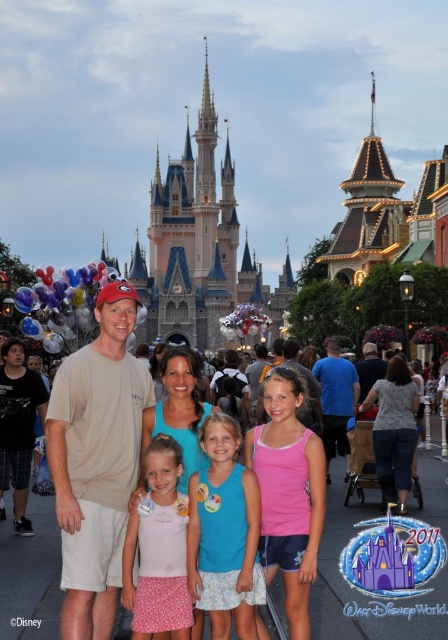
Does blue cotton tank top at center lie in front of pink fabric dress at center?

No, blue cotton tank top at center is further to the viewer.

Who is more distant from viewer, (209,502) or (177,541)?

The point (209,502) is more distant.

Is point (261, 576) positioned after point (155, 602)?

Yes, point (261, 576) is behind point (155, 602).

The height and width of the screenshot is (640, 448). I want to click on blue cotton tank top at center, so click(x=224, y=532).

Is matte khaki shirt at center shorter than pink fabric dress at center?

No.

Between point (30, 600) and point (185, 604), which one is positioned in front?

Point (185, 604) is in front.

You are a GUI agent. You are given a task and a screenshot of the screen. Output one action in this format:
    pyautogui.click(x=<x>, y=<y>)
    Task: Click on the matte khaki shirt at center
    Image resolution: width=448 pixels, height=640 pixels.
    Given the screenshot: What is the action you would take?
    pyautogui.click(x=361, y=593)

Who is positioned more to the left, matte khaki shirt at center or blue cotton tank top at center?

blue cotton tank top at center is more to the left.

Is the position of matte khaki shirt at center less distant than that of blue cotton tank top at center?

No, it is behind blue cotton tank top at center.

What are the coordinates of `matte khaki shirt at center` in the screenshot? It's located at (361, 593).